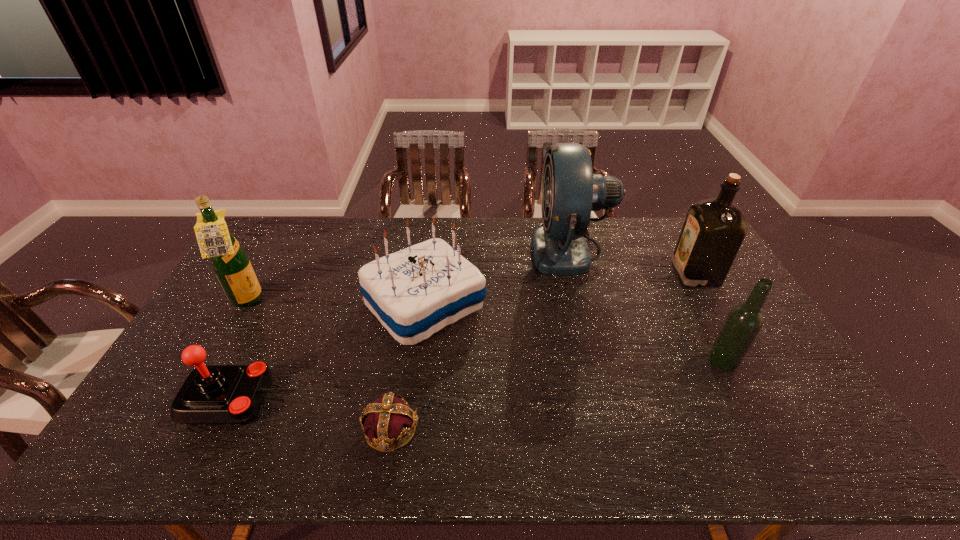
Where is `the third closest liquor relative to the crown`? The image size is (960, 540). the third closest liquor relative to the crown is located at coordinates (714, 229).

The image size is (960, 540). What are the coordinates of `liquor that is the third nearest to the birthday cake` in the screenshot? It's located at (714, 229).

Where is `vacant position in the image that satisfies the following two spatial constraints: 1. in front of the fan to blow air; 2. on the right side of the shortest liquor`? This screenshot has width=960, height=540. vacant position in the image that satisfies the following two spatial constraints: 1. in front of the fan to blow air; 2. on the right side of the shortest liquor is located at coordinates (599, 361).

Identify the location of free region that satisfies the following two spatial constraints: 1. on the back side of the shortest object; 2. on the front-facing side of the leftmost liquor. (412, 302).

The width and height of the screenshot is (960, 540). Find the location of `free space in the image that satisfies the following two spatial constraints: 1. on the base of the sixth tallest object; 2. on the back side of the shortest object`. free space in the image that satisfies the following two spatial constraints: 1. on the base of the sixth tallest object; 2. on the back side of the shortest object is located at coordinates (217, 429).

Find the location of a particular element. This screenshot has width=960, height=540. free region that satisfies the following two spatial constraints: 1. on the front-facing side of the shortest object; 2. on the left side of the leftmost liquor is located at coordinates (175, 429).

Identify the location of vacant area that satisfies the following two spatial constraints: 1. in front of the third object from right to left to blow air; 2. on the back side of the nearest liquor. Image resolution: width=960 pixels, height=540 pixels. (599, 361).

Identify the location of free space that satisfies the following two spatial constraints: 1. in front of the nearest liquor to blow air; 2. on the right side of the third object from right to left. Image resolution: width=960 pixels, height=540 pixels. (599, 361).

Locate an element on the screen. The height and width of the screenshot is (540, 960). free space that satisfies the following two spatial constraints: 1. on the front-facing side of the shortest liquor; 2. on the left side of the leftmost liquor is located at coordinates (213, 361).

I want to click on free spot that satisfies the following two spatial constraints: 1. on the back side of the birthday cake; 2. on the front-facing side of the leftmost liquor, so click(425, 302).